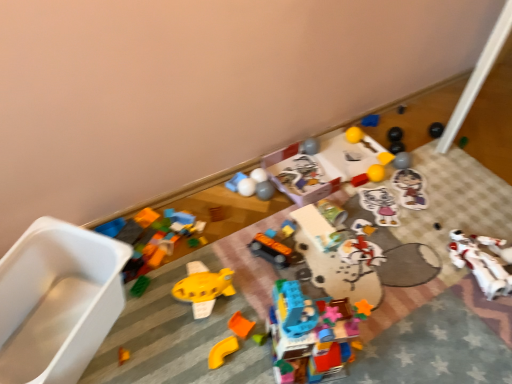
Identify the location of free spot in front of matte white plush cat at center, the thirteenth toy viewed from the left. This screenshot has width=512, height=384. (387, 248).